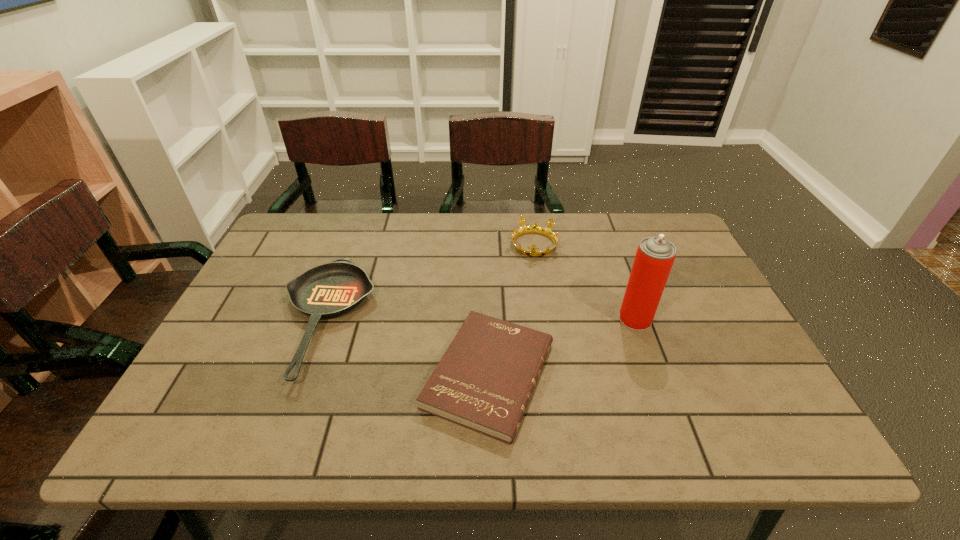
In order to click on object that is at the far edge in this screenshot , I will do `click(535, 228)`.

You are a GUI agent. You are given a task and a screenshot of the screen. Output one action in this format:
    pyautogui.click(x=<x>, y=<y>)
    Task: Click on the object that is at the near edge
    This screenshot has width=960, height=540.
    Given the screenshot: What is the action you would take?
    pyautogui.click(x=484, y=381)

The image size is (960, 540). What are the coordinates of `object that is at the left edge` in the screenshot? It's located at (329, 290).

Locate an element on the screen. This screenshot has height=540, width=960. vacant area at the far edge of the desktop is located at coordinates (623, 228).

In order to click on free region at the near edge in this screenshot , I will do `click(425, 431)`.

Locate an element on the screen. Image resolution: width=960 pixels, height=540 pixels. vacant position at the left edge of the desktop is located at coordinates (216, 348).

At what (x,y) coordinates should I click in order to perform the action: click on free region at the right edge of the desktop. Please return your answer as a coordinate pair (x, y). The width and height of the screenshot is (960, 540). Looking at the image, I should click on (721, 344).

In order to click on blank area at the far left corner in this screenshot , I will do `click(277, 241)`.

Locate an element on the screen. This screenshot has width=960, height=540. free location at the far right corner of the desktop is located at coordinates (649, 222).

Find the location of a particular element. This screenshot has width=960, height=540. empty space between the frying pan and the hardback book is located at coordinates (407, 347).